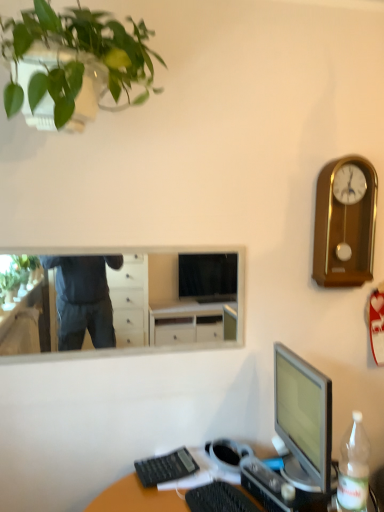
Locate an element on the screen. This screenshot has height=512, width=384. free point above black plastic keyboard at lower center, the second computer keyboard from the left (from a real-world perspective) is located at coordinates (224, 498).